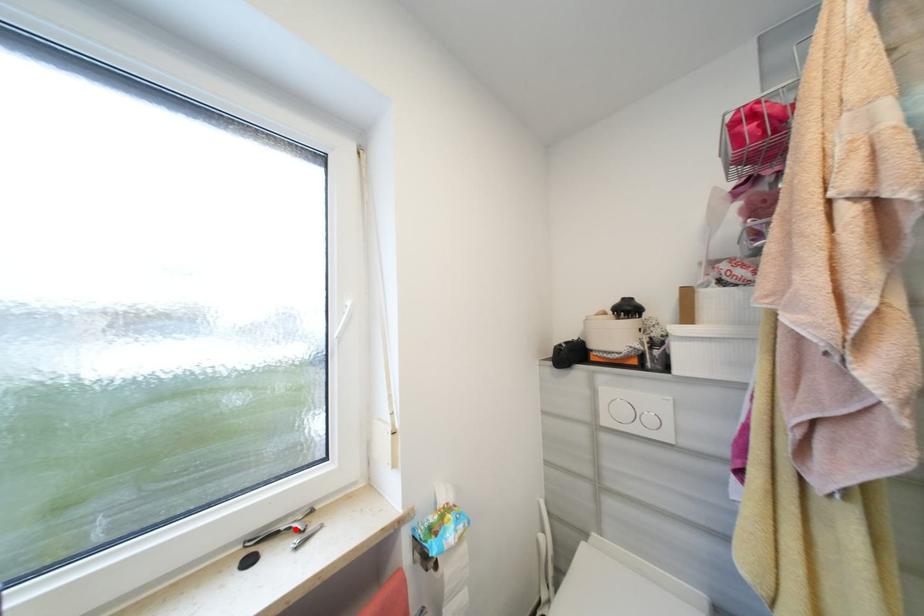
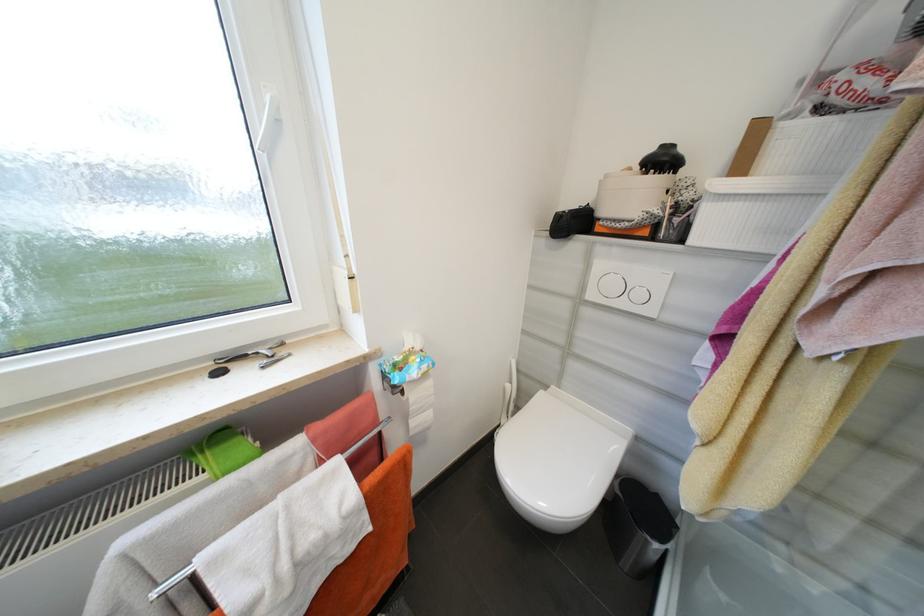
In the second image, find the point that corresponds to the highlighted location in the first image.

(262, 354)